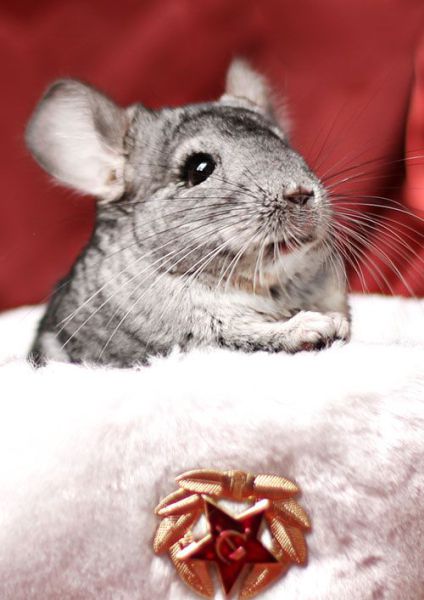
Where is `blanket`? This screenshot has width=424, height=600. blanket is located at coordinates (343, 404).